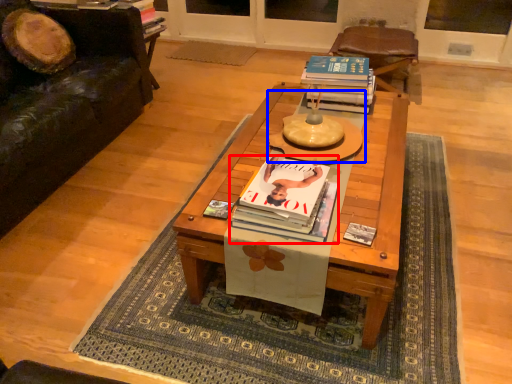
Question: Among these objects, which one is farthest to the camera, book (highlighted by a red box) or round table (highlighted by a blue box)?

Choices:
 (A) book
 (B) round table

Answer: (B)